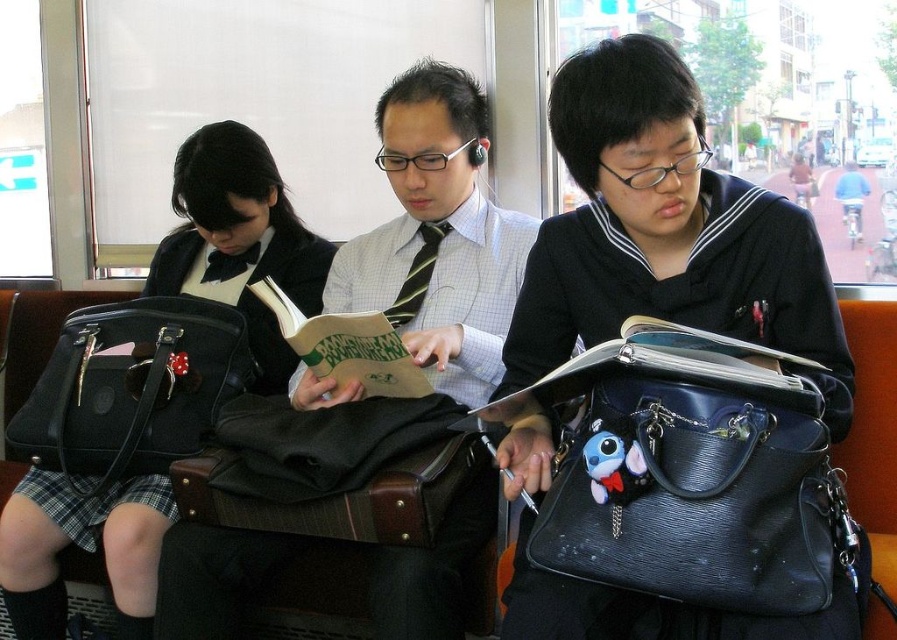
Question: Does matte black book at center have a lesser width compared to green paper book at center?

Choices:
 (A) no
 (B) yes

Answer: (A)

Question: Which of the following is the farthest from the observer?

Choices:
 (A) black leather bag at left
 (B) matte black book at center

Answer: (A)

Question: Among these points, which one is farthest from the camera?

Choices:
 (A) (53, 420)
 (B) (685, 336)
 (C) (614, 282)
 (D) (42, 584)

Answer: (A)

Question: Considering the relative positions of leather handbag at center and black leather bag at left in the image provided, where is leather handbag at center located with respect to black leather bag at left?

Choices:
 (A) above
 (B) below

Answer: (B)

Question: Is matte black tie at center above black leather bag at left?

Choices:
 (A) no
 (B) yes

Answer: (B)

Question: Which point is farther to the camera?

Choices:
 (A) (396, 337)
 (B) (63, 502)
 (C) (747, 368)

Answer: (B)